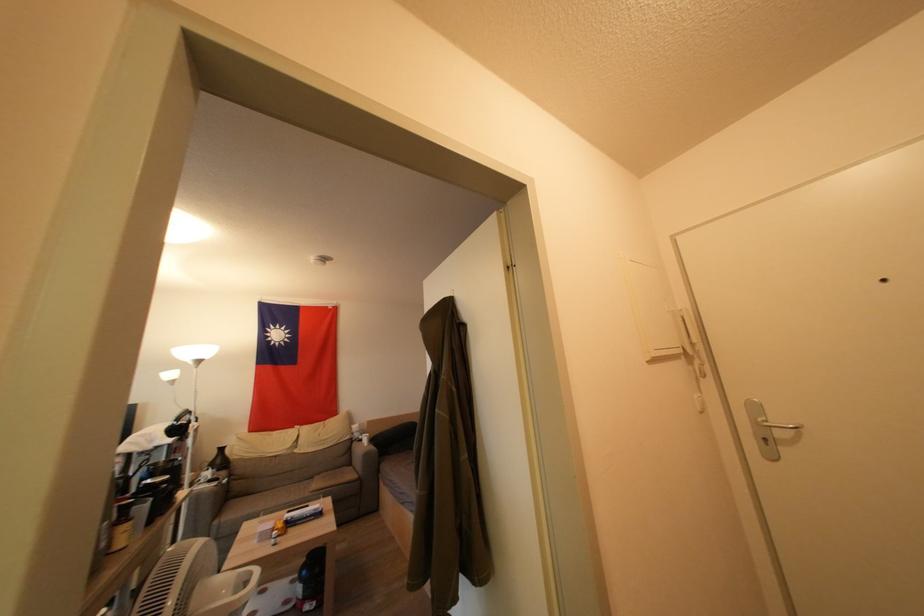
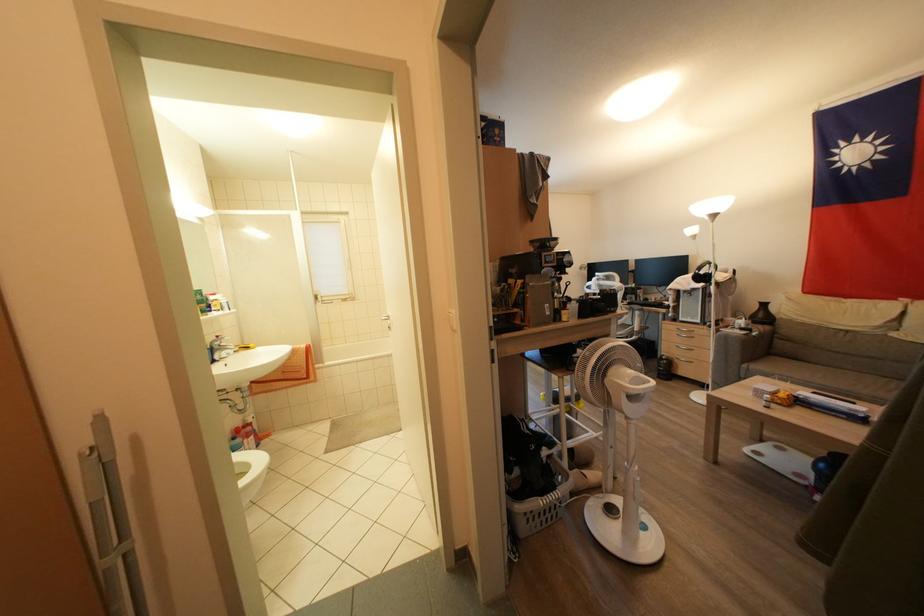
Where in the second image is the point corresponding to the point at 221,525 from the first image?

(748, 370)